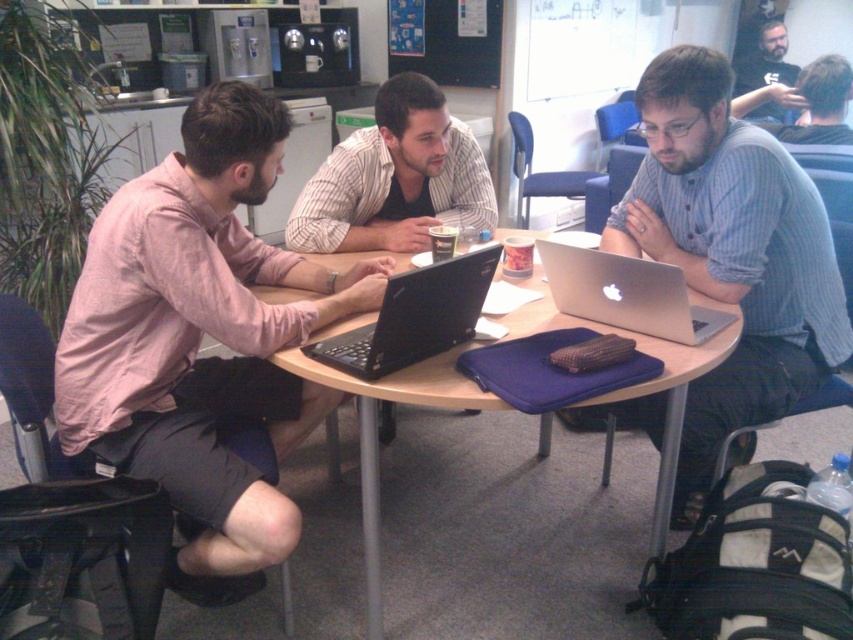
Who is positioned more to the left, pink shirt at left or silver metallic laptop at center?

pink shirt at left

Does pink shirt at left appear on the left side of silver metallic laptop at center?

Indeed, pink shirt at left is positioned on the left side of silver metallic laptop at center.

Does point (280, 376) lie behind point (596, 300)?

Yes.

Locate an element on the screen. This screenshot has width=853, height=640. pink shirt at left is located at coordinates (200, 340).

What do you see at coordinates (200, 340) in the screenshot?
I see `pink shirt at left` at bounding box center [200, 340].

Who is more distant from viewer, (195, 195) or (440, 193)?

The point (440, 193) is more distant.

Where is `pink shirt at left`? Image resolution: width=853 pixels, height=640 pixels. pink shirt at left is located at coordinates (200, 340).

Locate an element on the screen. The image size is (853, 640). pink shirt at left is located at coordinates (200, 340).

The image size is (853, 640). I want to click on striped shirt at center, so click(x=395, y=179).

Which is more to the left, striped shirt at center or black matte laptop at center?

striped shirt at center

Image resolution: width=853 pixels, height=640 pixels. Find the location of `striped shirt at center`. striped shirt at center is located at coordinates (395, 179).